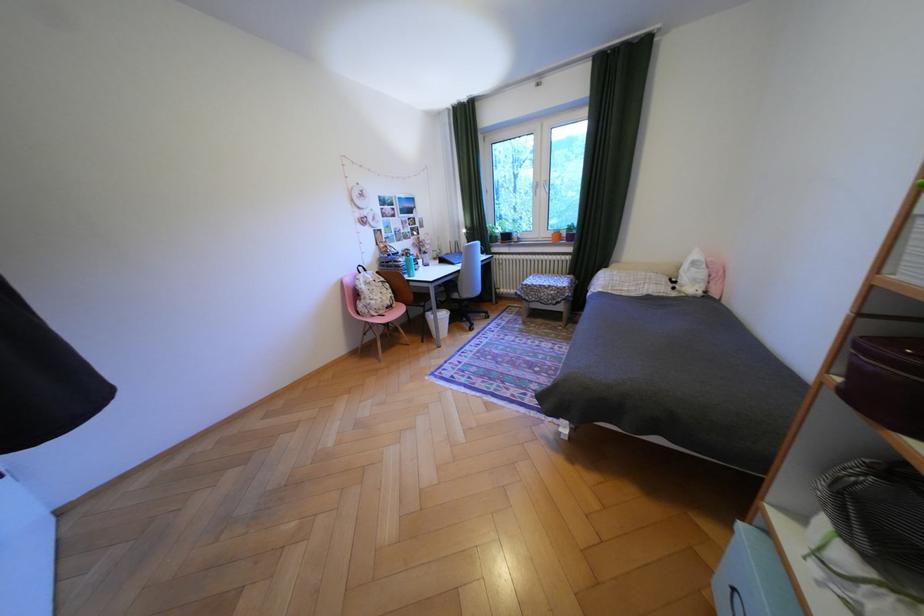
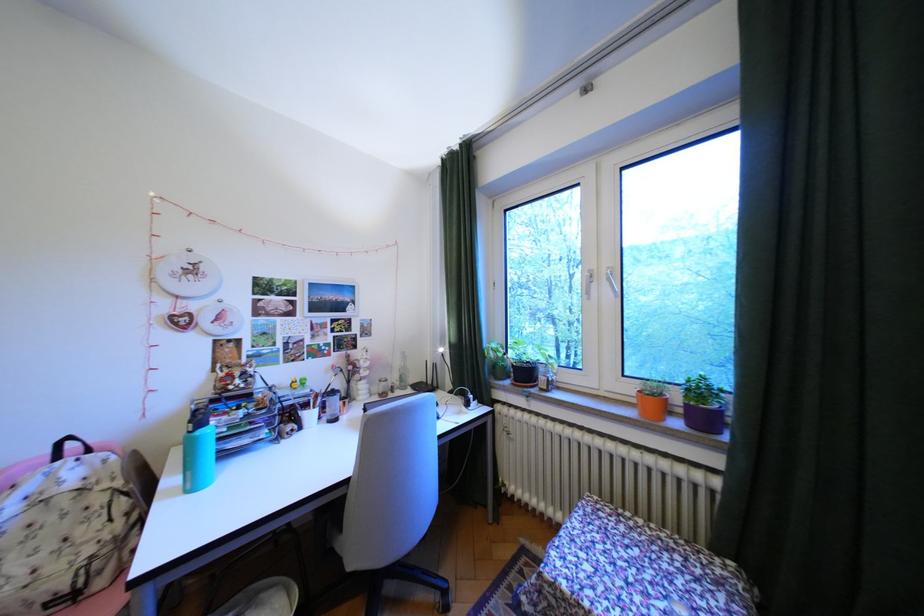
Find the pixel in the second image that matches point 562,233 in the first image.

(641, 390)